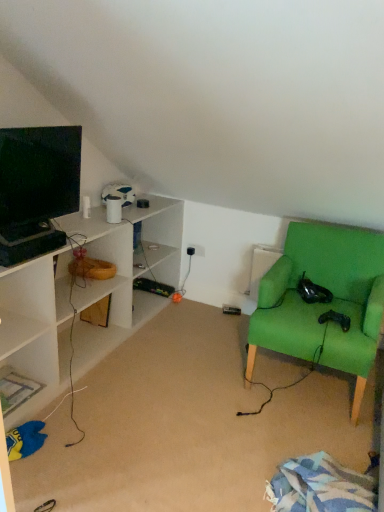
Question: Is green fabric chair at right situated inside black plastic electric outlet at center or outside?

Choices:
 (A) outside
 (B) inside

Answer: (A)

Question: Is green fabric chair at right bigger or smaller than black plastic electric outlet at center?

Choices:
 (A) big
 (B) small

Answer: (A)

Question: Estimate the real-world distances between objects in this image. Which object is closer to the black plastic electric outlet at center?

Choices:
 (A) green fabric chair at right
 (B) matte black monitor at left
 (C) green fabric chair at right

Answer: (C)

Question: Based on their relative distances, which object is farther from the black plastic electric outlet at center?

Choices:
 (A) green fabric chair at right
 (B) green fabric chair at right
 (C) matte black monitor at left

Answer: (C)